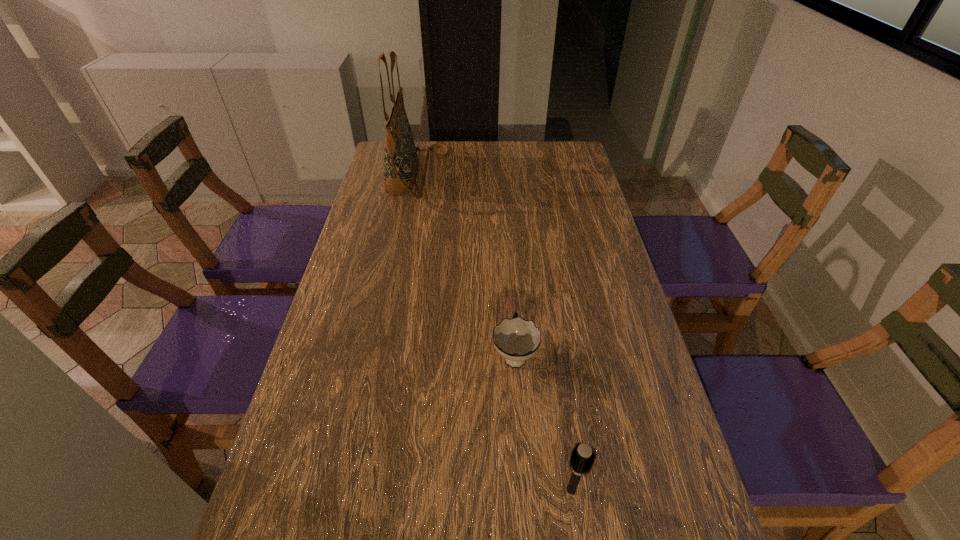
The height and width of the screenshot is (540, 960). In order to click on free space that satisfies the following two spatial constraints: 1. on the front-facing side of the farthest object; 2. on the left side of the hairbrush in this screenshot , I will do click(355, 489).

Identify the location of free spot that satisfies the following two spatial constraints: 1. on the front-facing side of the nearest object; 2. on the left side of the tallest object. The height and width of the screenshot is (540, 960). (355, 489).

At what (x,y) coordinates should I click in order to perform the action: click on free space in the image that satisfies the following two spatial constraints: 1. on the front-facing side of the tallest object; 2. on the right side of the hairbrush. Please return your answer as a coordinate pair (x, y). The height and width of the screenshot is (540, 960). Looking at the image, I should click on (355, 489).

Identify the location of free location that satisfies the following two spatial constraints: 1. on the front-facing side of the nearest object; 2. on the right side of the handbag. This screenshot has width=960, height=540. (355, 489).

Identify the location of free space that satisfies the following two spatial constraints: 1. on the front-facing side of the leftmost object; 2. on the side of the second object from left to right with the handle. The height and width of the screenshot is (540, 960). (382, 354).

At what (x,y) coordinates should I click in order to perform the action: click on vacant space that satisfies the following two spatial constraints: 1. on the front-facing side of the tallest object; 2. on the side of the shortest object with the handle. Please return your answer as a coordinate pair (x, y). The height and width of the screenshot is (540, 960). Looking at the image, I should click on (382, 354).

The image size is (960, 540). Identify the location of vacant space that satisfies the following two spatial constraints: 1. on the front-facing side of the tallest object; 2. on the left side of the second tallest object. (355, 489).

Find the location of a particular element. free space that satisfies the following two spatial constraints: 1. on the front-facing side of the farthest object; 2. on the side of the second farthest object with the handle is located at coordinates (382, 354).